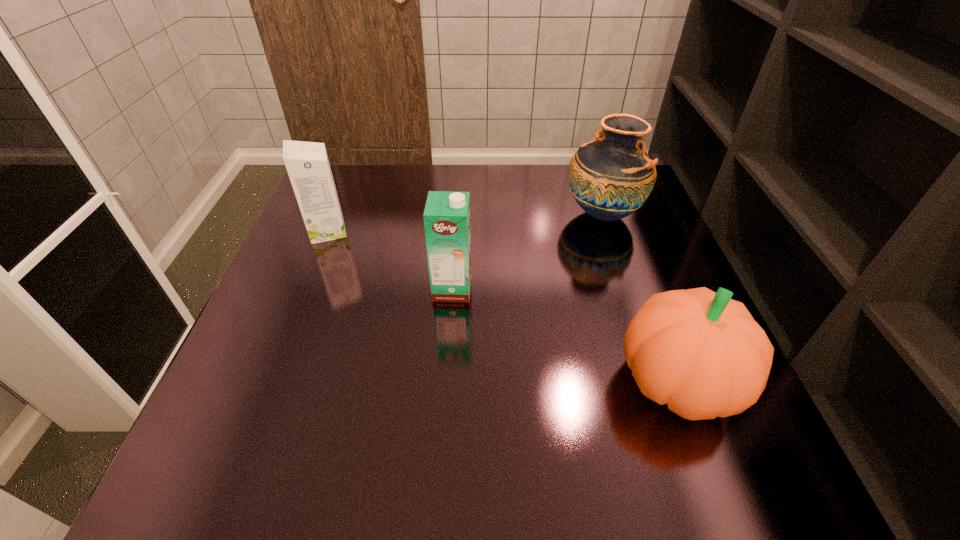
Where is `object located at the far edge`? This screenshot has width=960, height=540. object located at the far edge is located at coordinates (610, 177).

Find the location of `object that is at the near edge`. object that is at the near edge is located at coordinates (700, 352).

Find the location of a particular element. object located at the left edge is located at coordinates (307, 164).

This screenshot has width=960, height=540. Find the location of `pottery that is positioned at the right edge`. pottery that is positioned at the right edge is located at coordinates (610, 177).

Locate an element on the screen. pumpkin located at the right edge is located at coordinates (700, 352).

The image size is (960, 540). Find the location of `object that is positioned at the far right corner`. object that is positioned at the far right corner is located at coordinates (610, 177).

The width and height of the screenshot is (960, 540). In order to click on object that is at the near right corner in this screenshot , I will do point(700,352).

In the image, there is a desktop. At what (x,y) coordinates should I click in order to perform the action: click on vacant region at the far edge. Please return your answer as a coordinate pair (x, y). The image size is (960, 540). Looking at the image, I should click on 398,167.

Where is `free space at the near edge of the desktop`? The image size is (960, 540). free space at the near edge of the desktop is located at coordinates 468,473.

This screenshot has height=540, width=960. Find the location of `free space at the left edge of the desktop`. free space at the left edge of the desktop is located at coordinates (284, 434).